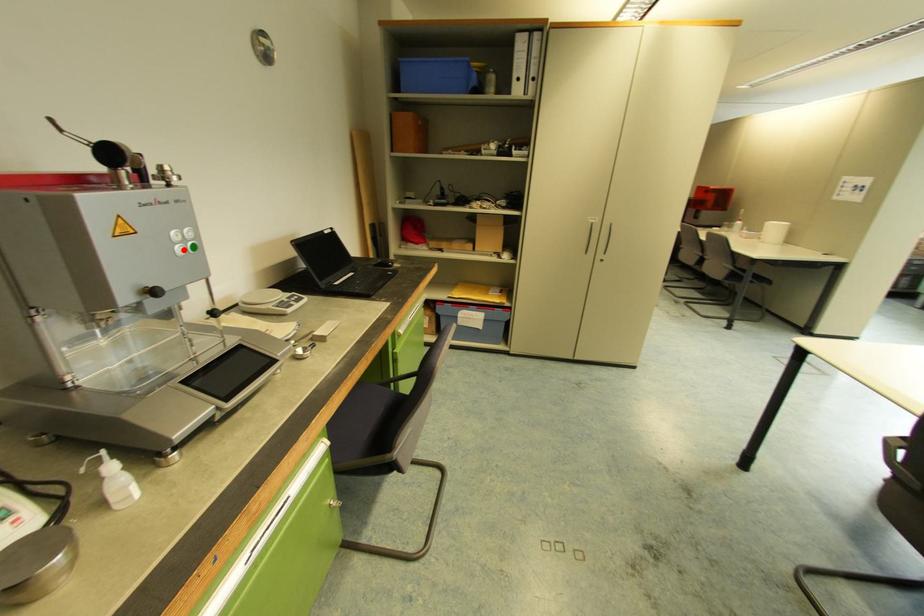
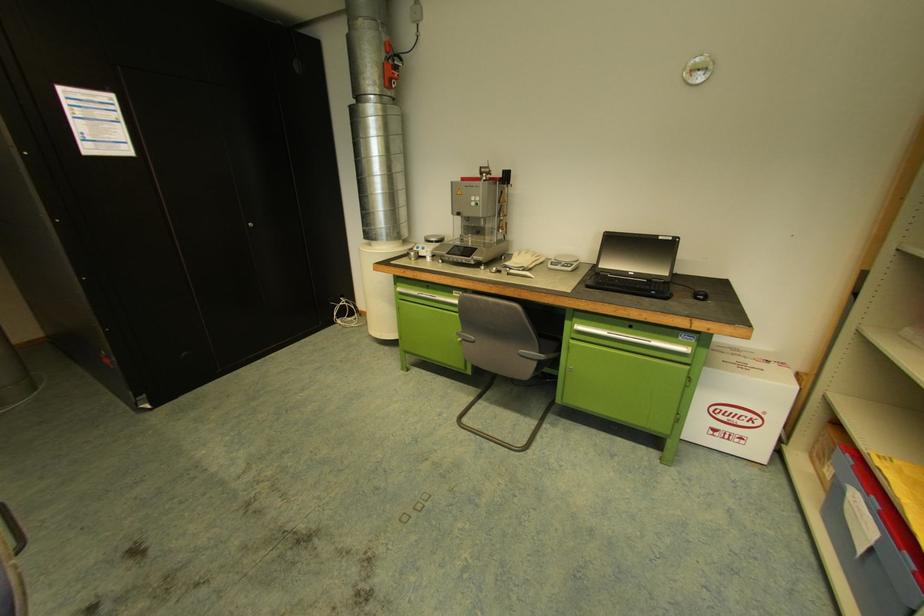
In the second image, find the point that corresponds to the highlighted location in the first image.

(477, 204)